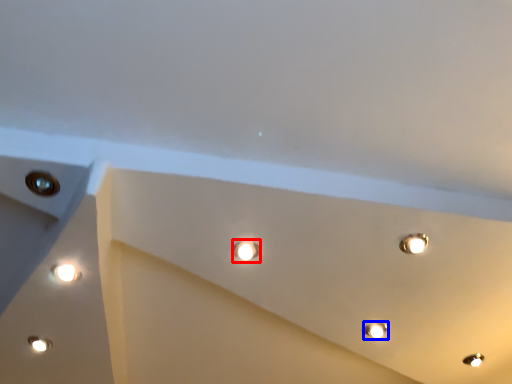
Question: Which of the following is the closest to the observer, droplight (highlighted by a red box) or lamp (highlighted by a blue box)?

Choices:
 (A) droplight
 (B) lamp

Answer: (A)